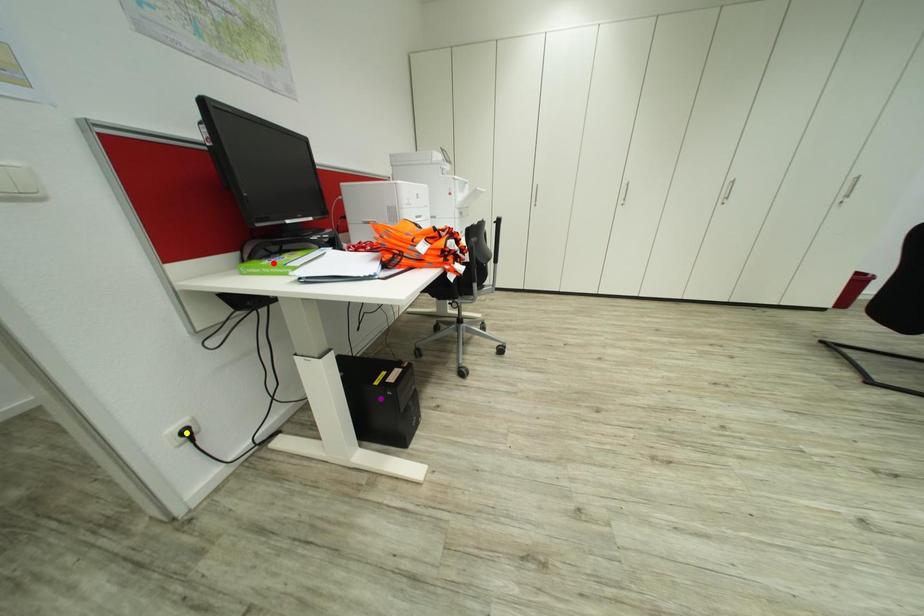
Order these from nearest to farthest:
yellow point | purple point | red point

red point → yellow point → purple point